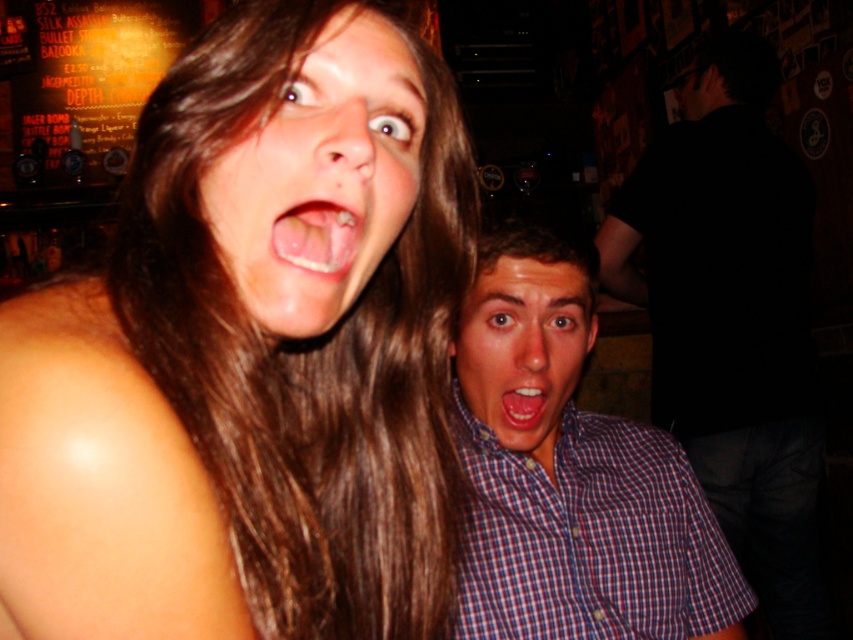
You are a photographer trying to capture a candid shot of the white glossy tongue at center and the brown hair at upper left. Since you want both elements in focus, which one should you adjust your camera focus on first to ensure proper alignment?

The brown hair at upper left is positioned on the left side of white glossy tongue at center. To ensure both are in focus, focus on the brown hair at upper left first, then adjust slightly towards the white glossy tongue at center since they are spatially aligned.

You are a photographer trying to capture the scene. You notice the brown hair at upper left and the white glossy tongue at center. Which object is located below the other?

The brown hair at upper left is positioned under the white glossy tongue at center, meaning the brown hair is below the white glossy tongue.

You are a photographer trying to capture the brown hair at center in the image. The camera you are using has a focus point at coordinate point (320, 177). Will this focus point successfully capture the brown hair at center?

Yes, the focus point at coordinate point (320, 177) is exactly where the brown hair at center is located, so it will successfully capture the brown hair at center.